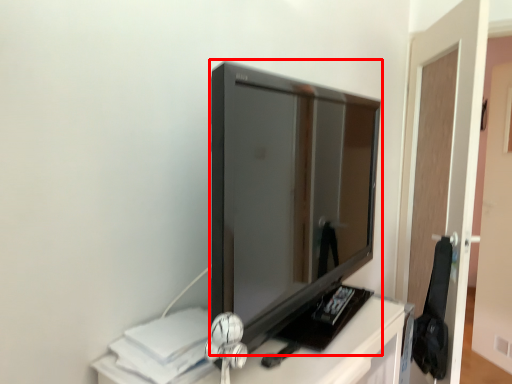
Question: Considering the relative positions of television (annotated by the red box) and glass door in the image provided, where is television (annotated by the red box) located with respect to the staircase?

Choices:
 (A) left
 (B) right

Answer: (A)